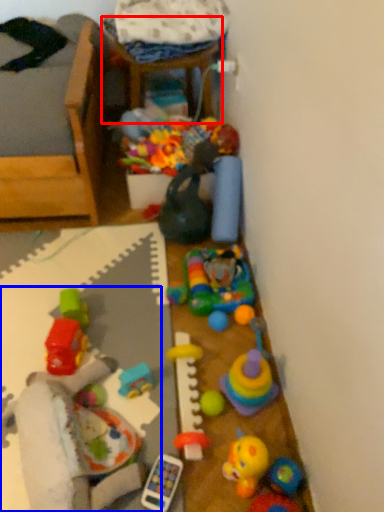
Question: Which point is further to the camera, furniture (highlighted by a red box) or toy (highlighted by a blue box)?

Choices:
 (A) furniture
 (B) toy

Answer: (A)